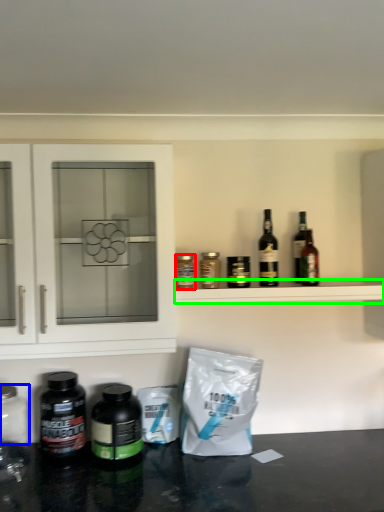
Question: Based on their relative distances, which object is nearer to bottle (highlighted by a red box)? Choose from glass jar (highlighted by a blue box) and shelf (highlighted by a green box).

Choices:
 (A) glass jar
 (B) shelf

Answer: (B)